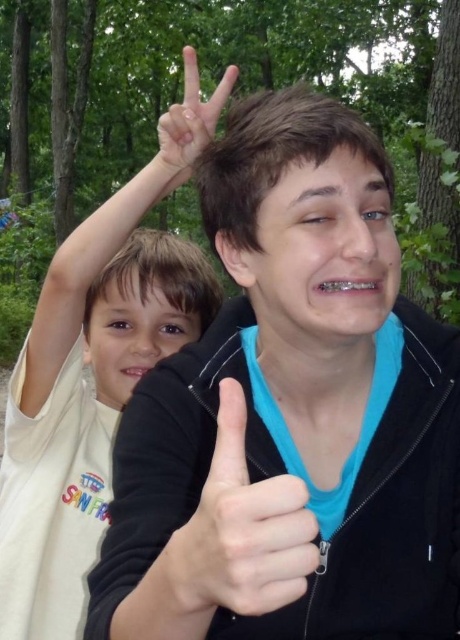
Is the position of light beige shirt at upper left less distant than that of smooth skin thumb up at center?

No, light beige shirt at upper left is behind smooth skin thumb up at center.

Which is behind, point (5, 588) or point (159, 586)?

The point (5, 588) is behind.

Who is more forward, [70,276] or [223,513]?

Point [223,513] is in front.

Identify the location of light beige shirt at upper left. The image size is (460, 640). (x=95, y=374).

Does point (90, 330) come closer to viewer compared to point (187, 125)?

No.

Does light beige shirt at upper left have a larger size compared to white matte hand at upper center?

Yes, light beige shirt at upper left is bigger than white matte hand at upper center.

Is point (193, 145) farther from viewer compared to point (178, 156)?

No, (193, 145) is in front of (178, 156).

At what (x,y) coordinates should I click in order to perform the action: click on light beige shirt at upper left. Please return your answer as a coordinate pair (x, y). The width and height of the screenshot is (460, 640). Looking at the image, I should click on (95, 374).

Does black matte jacket at center come in front of white matte hand at upper center?

Yes, it is in front of white matte hand at upper center.

Between black matte jacket at center and white matte hand at upper center, which one is positioned lower?

black matte jacket at center is lower down.

What do you see at coordinates (292, 413) in the screenshot?
I see `black matte jacket at center` at bounding box center [292, 413].

At what (x,y) coordinates should I click in order to perform the action: click on black matte jacket at center. Please return your answer as a coordinate pair (x, y). The height and width of the screenshot is (640, 460). Looking at the image, I should click on (292, 413).